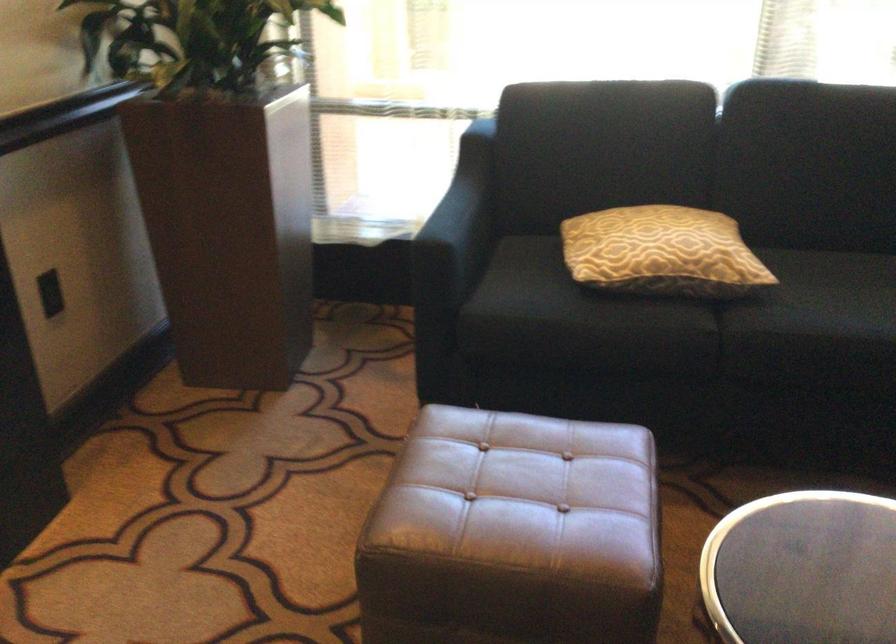
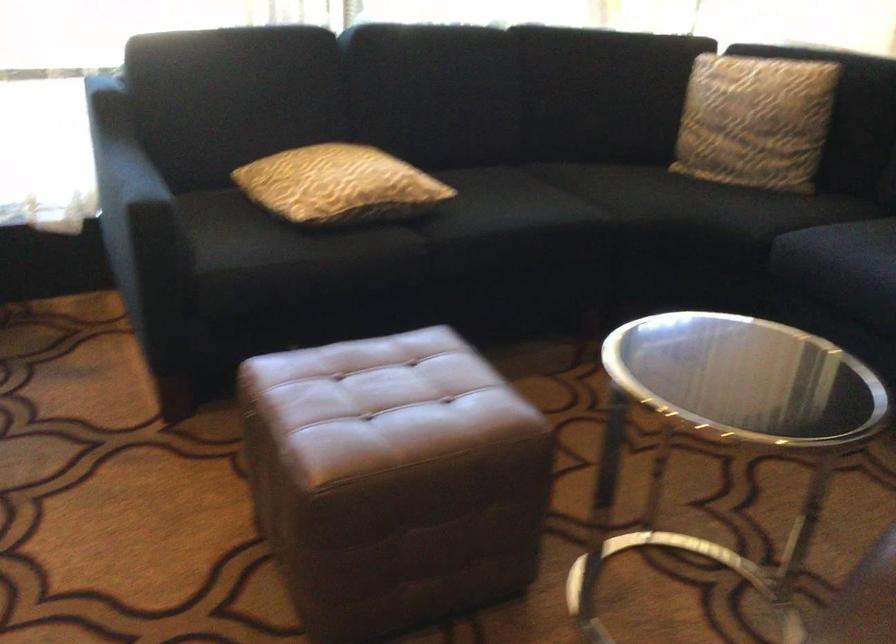
Locate, in the second image, the point that corresponds to (x=736, y=310) in the first image.

(426, 227)